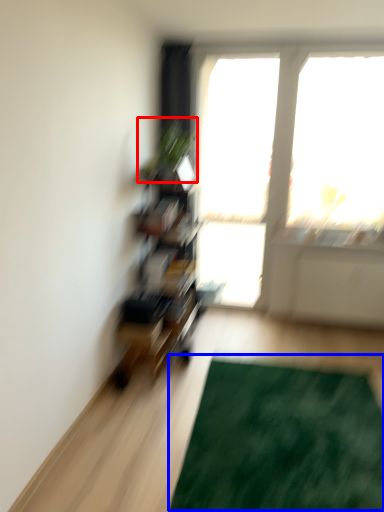
Question: Which point is further to the camera, plant (highlighted by a red box) or doormat (highlighted by a blue box)?

Choices:
 (A) plant
 (B) doormat

Answer: (A)